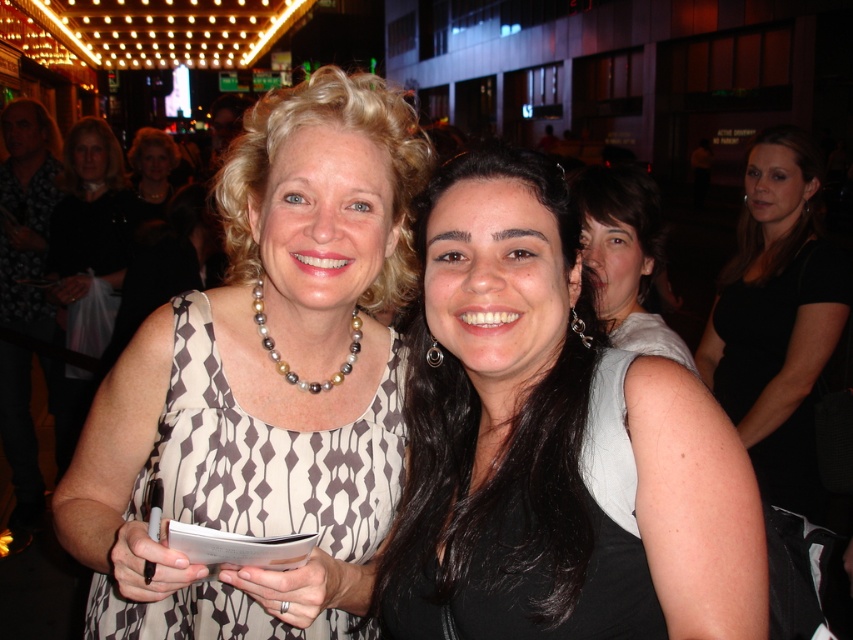
Question: Considering the relative positions of printed fabric dress at center and black dress at center in the image provided, where is printed fabric dress at center located with respect to black dress at center?

Choices:
 (A) above
 (B) below

Answer: (B)

Question: Which point is closer to the camera?

Choices:
 (A) (807, 244)
 (B) (654, 244)
 (C) (115, 282)
 (D) (556, 268)

Answer: (D)

Question: Which object is farther from the camera taking this photo?

Choices:
 (A) printed fabric dress at center
 (B) black satin dress at center
 (C) black matte dress at center

Answer: (B)

Question: Does smooth black dress at center have a larger size compared to matte gray shirt at center?

Choices:
 (A) yes
 (B) no

Answer: (B)

Question: Does printed fabric dress at center come behind black satin dress at center?

Choices:
 (A) no
 (B) yes

Answer: (A)

Question: Estimate the real-world distances between objects in this image. Which object is closer to the printed fabric dress at center?

Choices:
 (A) black satin dress at center
 (B) black matte dress at center
 (C) black dress at center
 (D) smooth black dress at center

Answer: (B)